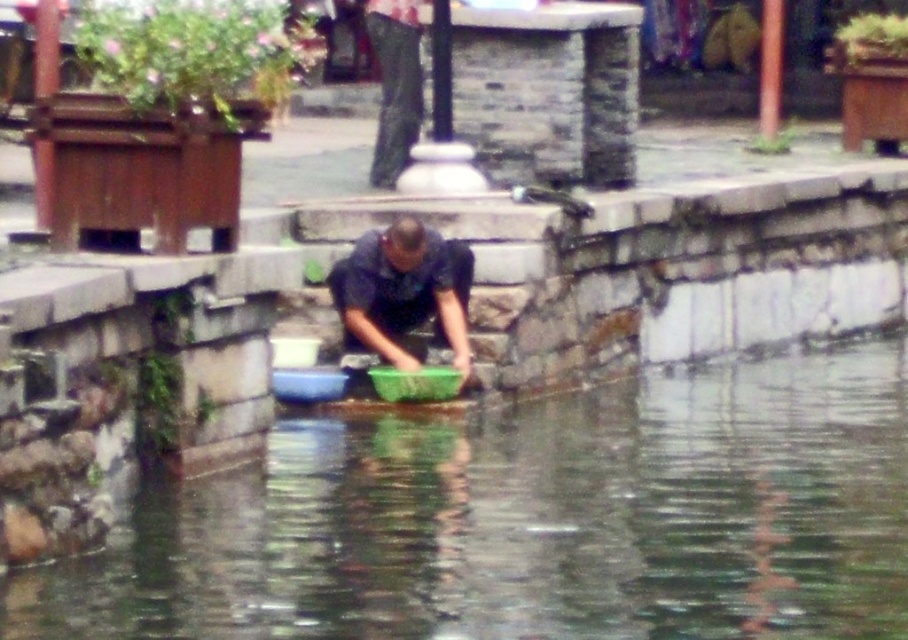
Question: Is clear water at center bigger than dark blue shirt at center?

Choices:
 (A) no
 (B) yes

Answer: (B)

Question: Among these points, which one is nearest to the camera?

Choices:
 (A) (420, 429)
 (B) (371, 264)

Answer: (A)

Question: Does clear water at center have a larger size compared to dark blue shirt at center?

Choices:
 (A) yes
 (B) no

Answer: (A)

Question: Is clear water at center below dark blue shirt at center?

Choices:
 (A) no
 (B) yes

Answer: (B)

Question: Which object is farther from the camera taking this photo?

Choices:
 (A) clear water at center
 (B) dark blue shirt at center

Answer: (B)